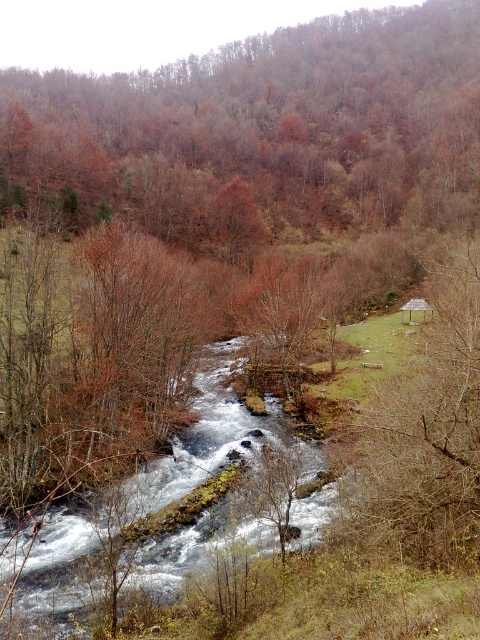
Question: Is brown matte tree at upper center closer to the viewer compared to brown leafless tree at center-right?

Choices:
 (A) yes
 (B) no

Answer: (B)

Question: Does brown matte tree at upper center have a lesser width compared to brown leafless tree at center-right?

Choices:
 (A) yes
 (B) no

Answer: (B)

Question: Which point is closer to the camera?

Choices:
 (A) brown leafless tree at center-right
 (B) brown matte tree at upper center

Answer: (A)

Question: Which object appears farthest from the camera in this image?

Choices:
 (A) brown matte tree at upper center
 (B) brown leafless tree at center-right

Answer: (A)

Question: Does brown matte tree at upper center come in front of brown leafless tree at center-right?

Choices:
 (A) no
 (B) yes

Answer: (A)